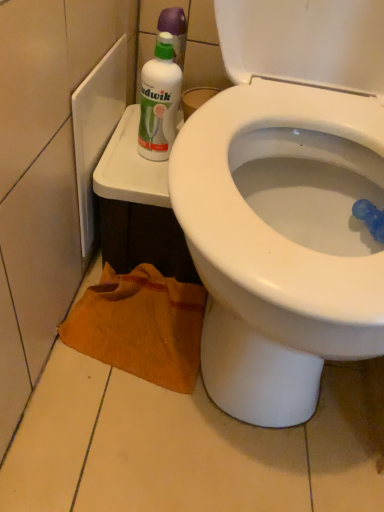
Locate an element on the screen. The height and width of the screenshot is (512, 384). free space in front of brown fabric towel at lower left is located at coordinates (124, 433).